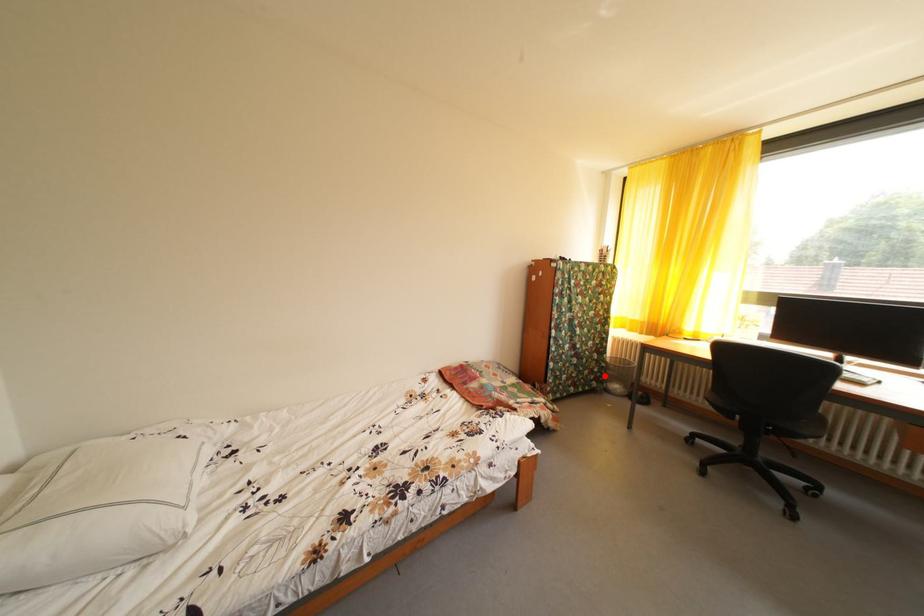
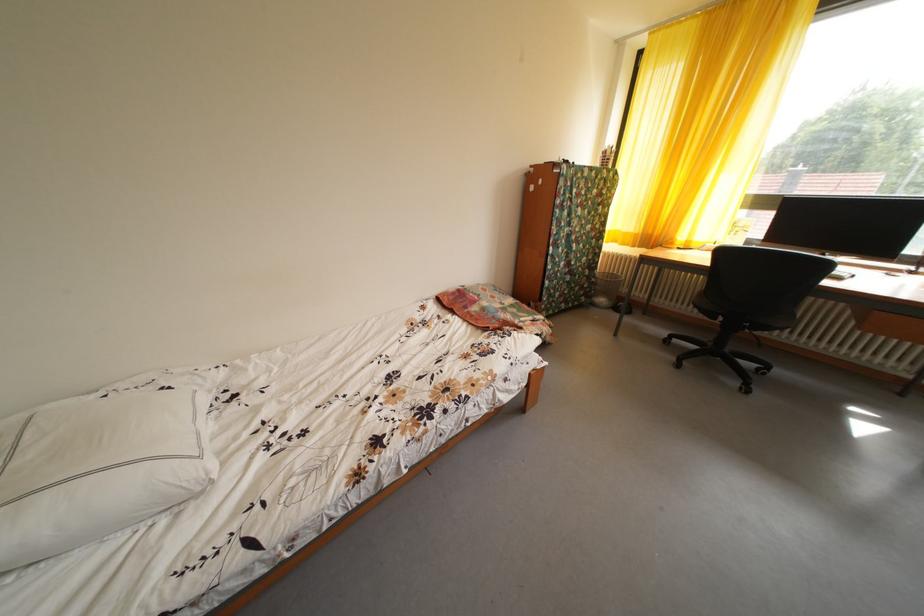
Question: A red point is marked in image1. In image2, is the corresponding 3D point closer to the camera or farther? Reply with the corresponding letter.

Choices:
 (A) The corresponding 3D point is closer.
 (B) The corresponding 3D point is farther.

Answer: (A)